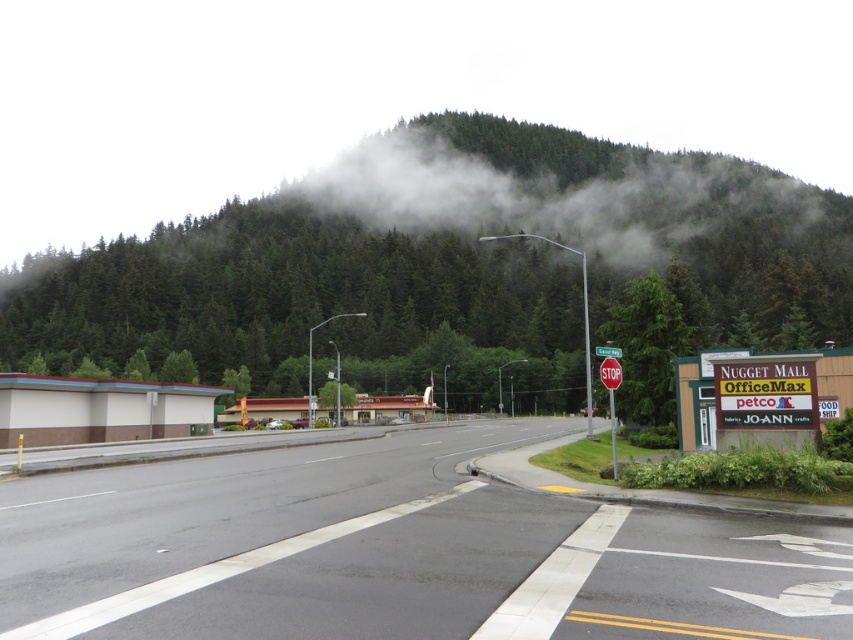
Is asphalt road at center below red metallic stop sign at upper center?

Yes, asphalt road at center is below red metallic stop sign at upper center.

Between point (743, 577) and point (612, 365), which one is positioned behind?

Point (612, 365)

At what (x,y) coordinates should I click in order to perform the action: click on asphalt road at center. Please return your answer as a coordinate pair (x, y). This screenshot has width=853, height=640. Looking at the image, I should click on (393, 552).

Where is `asphalt road at center`? The width and height of the screenshot is (853, 640). asphalt road at center is located at coordinates (393, 552).

Image resolution: width=853 pixels, height=640 pixels. What do you see at coordinates (610, 372) in the screenshot? I see `red metallic stop sign at upper center` at bounding box center [610, 372].

Can you confirm if red metallic stop sign at upper center is shorter than red plastic stop sign at center?

In fact, red metallic stop sign at upper center may be taller than red plastic stop sign at center.

Which is in front, point (605, 364) or point (602, 356)?

Point (605, 364) is in front.

At what (x,y) coordinates should I click in order to perform the action: click on red metallic stop sign at upper center. Please return your answer as a coordinate pair (x, y). This screenshot has width=853, height=640. Looking at the image, I should click on (610, 372).

Consider the image. Is green matte tree at center wider than red metallic stop sign at upper center?

Correct, the width of green matte tree at center exceeds that of red metallic stop sign at upper center.

Which is behind, point (653, 422) or point (608, 381)?

Positioned behind is point (653, 422).

I want to click on green matte tree at center, so click(647, 348).